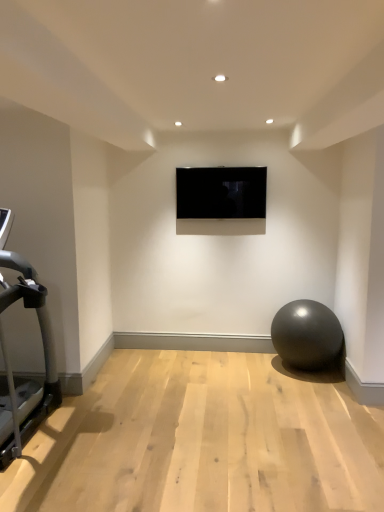
What are the coordinates of `vacant space underneath black glossy tv at center (from a real-world perspective)` in the screenshot? It's located at click(x=230, y=349).